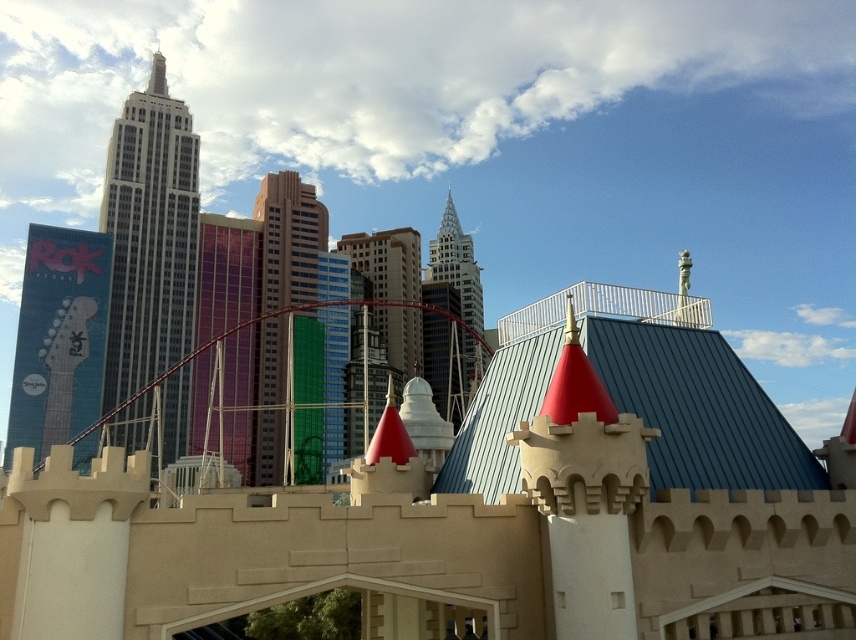
Question: Based on their relative distances, which object is farther from the metallic guitar at left?

Choices:
 (A) white glass skyscraper at upper left
 (B) green glass building at center

Answer: (B)

Question: Which point is farther to the camera?

Choices:
 (A) (318, 204)
 (B) (93, 353)

Answer: (A)

Question: Does metallic guitar at left have a larger size compared to green glass building at center?

Choices:
 (A) no
 (B) yes

Answer: (A)

Question: From the image, what is the correct spatial relationship of white glass skyscraper at upper left in relation to glassy steel tower at center?

Choices:
 (A) above
 (B) below

Answer: (A)

Question: Is green glass building at center smaller than glassy steel tower at center?

Choices:
 (A) yes
 (B) no

Answer: (A)

Question: Which point is closer to the camera?

Choices:
 (A) white glass skyscraper at upper left
 (B) glassy steel tower at center
 (C) green glass building at center

Answer: (A)